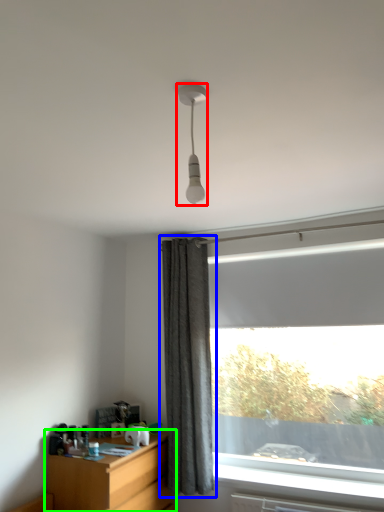
Question: Which object is positioned farthest from lamp (highlighted by a red box)? Select from curtain (highlighted by a blue box) and desk (highlighted by a green box).

Choices:
 (A) curtain
 (B) desk

Answer: (B)